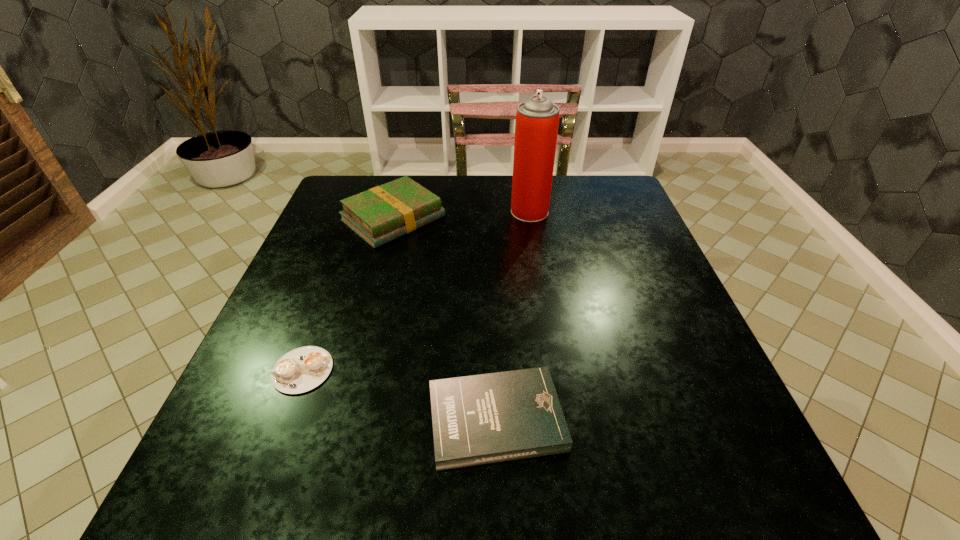
Locate an element on the screen. The height and width of the screenshot is (540, 960). empty space that is in between the farther book and the aerosol can is located at coordinates (462, 215).

You are a GUI agent. You are given a task and a screenshot of the screen. Output one action in this format:
    pyautogui.click(x=<x>, y=<y>)
    Task: Click on the free space that is in between the left book and the cappuccino
    
    Given the screenshot: What is the action you would take?
    pyautogui.click(x=348, y=294)

Locate an element on the screen. This screenshot has height=540, width=960. free spot between the tallest object and the right book is located at coordinates (513, 315).

Locate an element on the screen. This screenshot has width=960, height=540. free point between the tallest object and the second tallest object is located at coordinates (462, 215).

Identify the location of free space between the right book and the tallest object. (513, 315).

What are the coordinates of `vacant region between the left book and the cappuccino` in the screenshot? It's located at 348,294.

Locate an element on the screen. The width and height of the screenshot is (960, 540). free area in between the tallest object and the cappuccino is located at coordinates (416, 291).

This screenshot has height=540, width=960. I want to click on free space between the shortest object and the left book, so click(348, 294).

At what (x,y) coordinates should I click in order to perform the action: click on empty space that is in between the right book and the farther book. Please return your answer as a coordinate pair (x, y). Looking at the image, I should click on (444, 319).

Image resolution: width=960 pixels, height=540 pixels. What are the coordinates of `vacant area that lies between the tallest object and the taller book` in the screenshot? It's located at (462, 215).